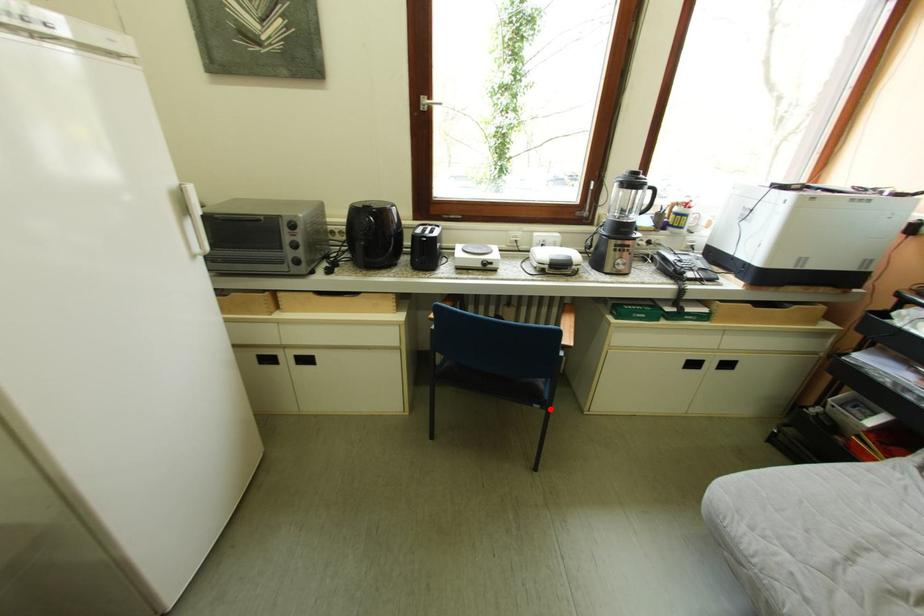
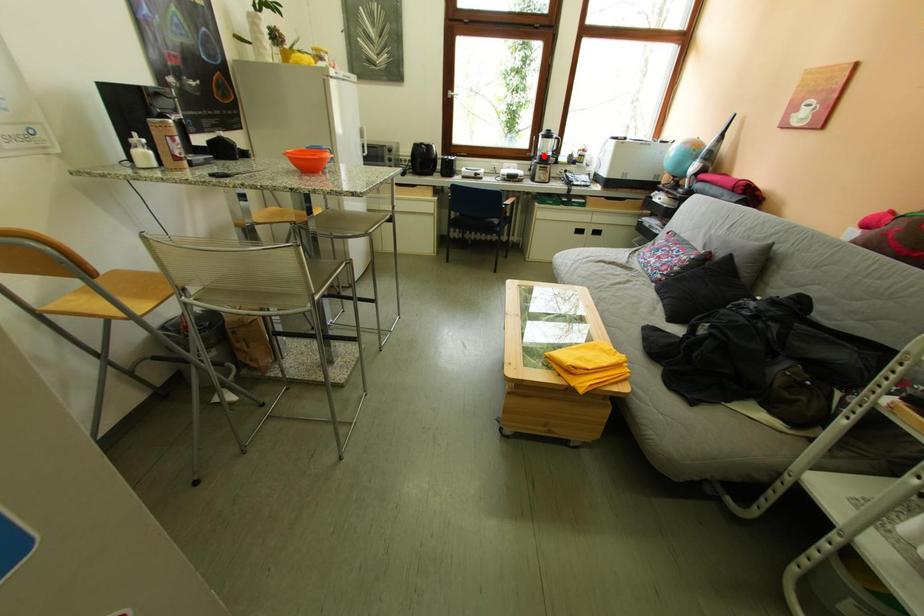
I am providing you with two images of the same scene from different viewpoints. A red point is marked on the first image and another point is marked on the second image. Does the point marked in image1 correspond to the same location as the one in image2?

No